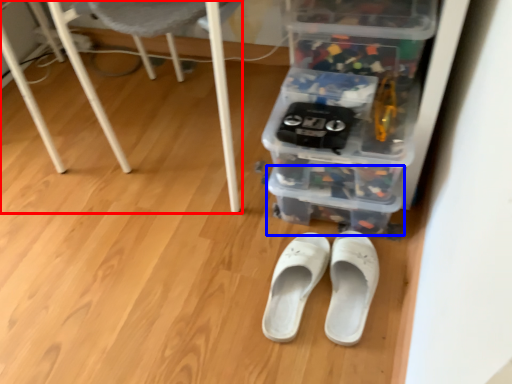
Question: Among these objects, which one is nearest to the camera, furniture (highlighted by a red box) or storage box (highlighted by a blue box)?

Choices:
 (A) furniture
 (B) storage box

Answer: (A)